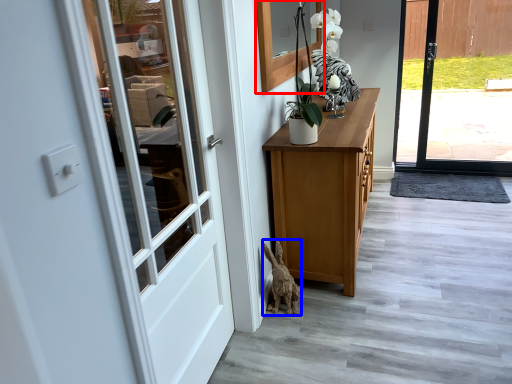
Question: Which point is further to the camera, window (highlighted by a red box) or animal (highlighted by a blue box)?

Choices:
 (A) window
 (B) animal

Answer: (B)